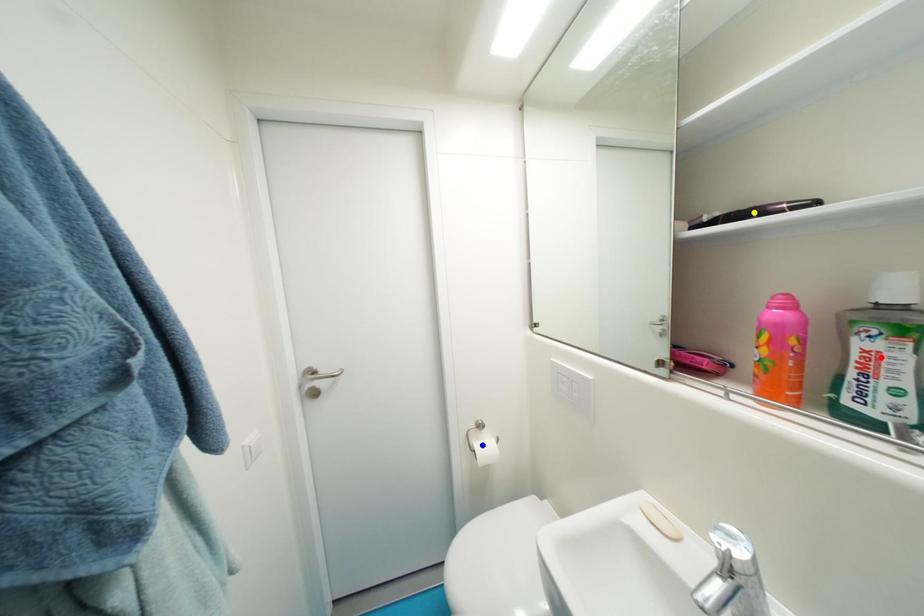
Order these from nearest to farthest:
A) blue point
B) yellow point
C) red point

red point
yellow point
blue point